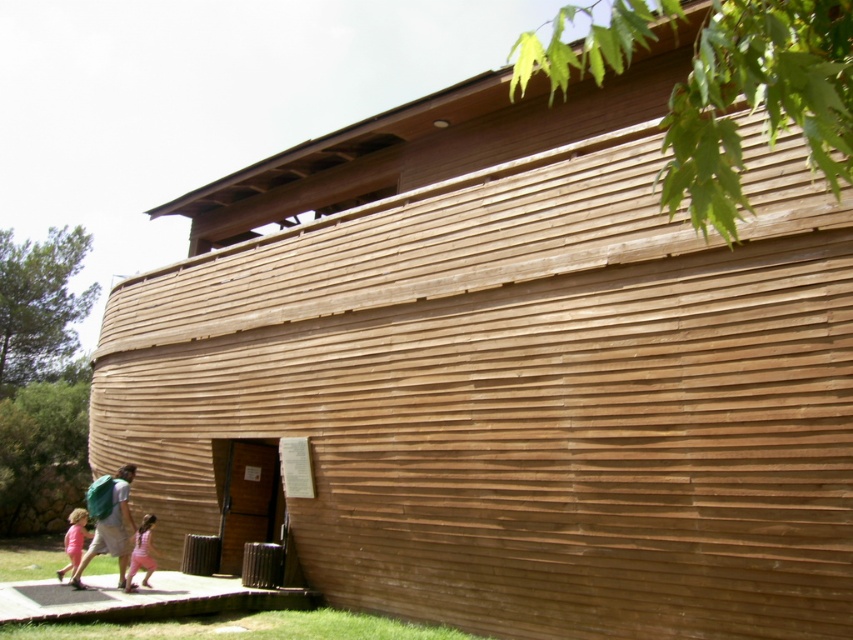
Question: Which object appears closest to the camera in this image?

Choices:
 (A) matte brown backpack at lower left
 (B) pink fabric dress at lower center

Answer: (B)

Question: Can you confirm if pink fabric dress at lower center is positioned below pink fabric dress at lower left?

Choices:
 (A) yes
 (B) no

Answer: (B)

Question: Which is nearer to the pink fabric dress at lower center?

Choices:
 (A) pink fabric dress at lower left
 (B) matte brown backpack at lower left

Answer: (B)

Question: Is matte brown backpack at lower left to the right of pink fabric dress at lower center from the viewer's perspective?

Choices:
 (A) no
 (B) yes

Answer: (A)

Question: In this image, where is matte brown backpack at lower left located relative to pink fabric dress at lower left?

Choices:
 (A) left
 (B) right

Answer: (B)

Question: Which point is closer to the camera taking this photo?

Choices:
 (A) (115, 545)
 (B) (67, 554)
 (C) (151, 552)

Answer: (A)